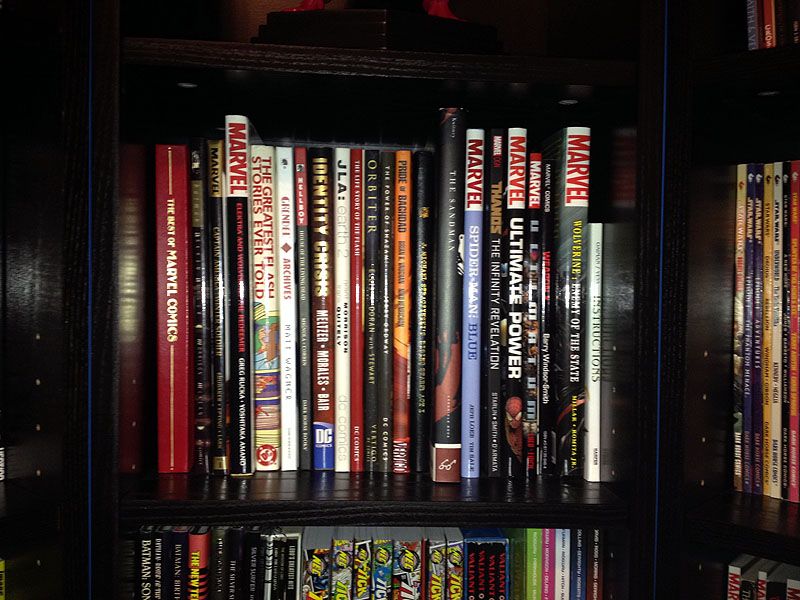
The width and height of the screenshot is (800, 600). What are the coordinates of `shelves` in the screenshot? It's located at (337, 500), (350, 68), (766, 513), (758, 88).